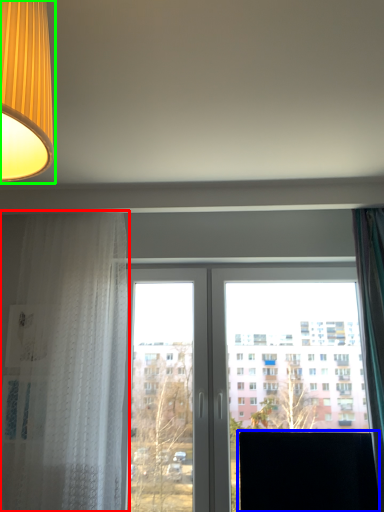
Question: Which is farther away from curtain (highlighted by a red box)? computer monitor (highlighted by a blue box) or lamp (highlighted by a green box)?

Choices:
 (A) computer monitor
 (B) lamp

Answer: (B)